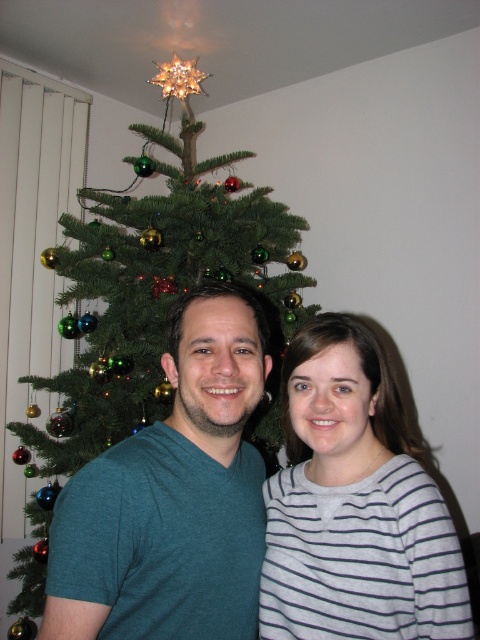
Between gray striped shirt at center and green matte christmas tree at center, which one appears on the left side from the viewer's perspective?

Positioned to the left is green matte christmas tree at center.

Is point (398, 440) in front of point (187, 128)?

Yes, point (398, 440) is closer to viewer.

Is point (342, 620) positioned behind point (93, 419)?

No, it is not.

You are a GUI agent. You are given a task and a screenshot of the screen. Output one action in this format:
    pyautogui.click(x=<x>, y=<y>)
    Task: Click on the gray striped shirt at center
    Image resolution: width=480 pixels, height=640 pixels.
    Given the screenshot: What is the action you would take?
    pyautogui.click(x=355, y=504)

Does teal matte t-shirt at center come behind gray striped shirt at center?

No.

Is teal matte t-shirt at center to the left of gray striped shirt at center from the viewer's perspective?

Correct, you'll find teal matte t-shirt at center to the left of gray striped shirt at center.

The image size is (480, 640). What do you see at coordinates (172, 497) in the screenshot?
I see `teal matte t-shirt at center` at bounding box center [172, 497].

At what (x,y) coordinates should I click in order to perform the action: click on teal matte t-shirt at center. Please return your answer as a coordinate pair (x, y). Looking at the image, I should click on (172, 497).

Is teal matte t-shirt at center to the left of green matte christmas tree at center from the viewer's perspective?

No, teal matte t-shirt at center is not to the left of green matte christmas tree at center.

Is teal matte t-shirt at center bigger than green matte christmas tree at center?

Actually, teal matte t-shirt at center might be smaller than green matte christmas tree at center.

Is point (193, 390) closer to viewer compared to point (24, 440)?

Yes, it is.

Where is `teal matte t-shirt at center`? The height and width of the screenshot is (640, 480). teal matte t-shirt at center is located at coordinates 172,497.